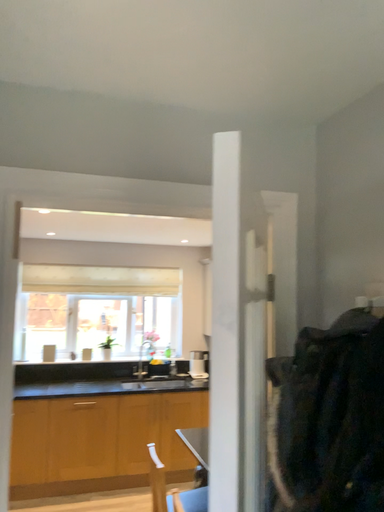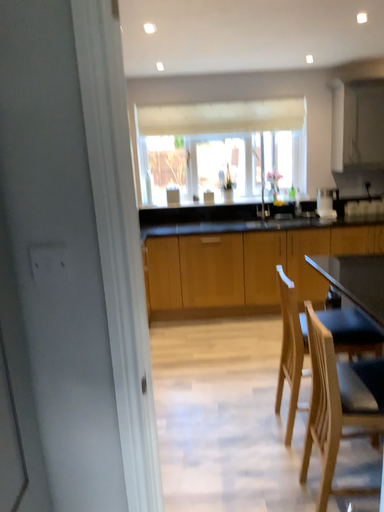
Question: How did the camera likely rotate when shooting the video?

Choices:
 (A) rotated right
 (B) rotated left

Answer: (B)